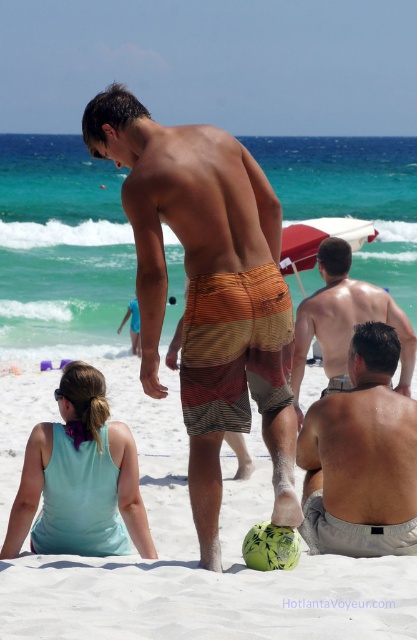
Is green textured ball at center below striped cotton shorts at center?

Indeed, green textured ball at center is positioned under striped cotton shorts at center.

Does green textured ball at center have a larger size compared to striped cotton shorts at center?

Yes, green textured ball at center is bigger than striped cotton shorts at center.

Is point (185, 592) in front of point (193, 362)?

Yes, it is in front of point (193, 362).

Locate an element on the screen. green textured ball at center is located at coordinates (198, 560).

Who is taller, green textured ball at center or light blue fabric dress at lower left?

light blue fabric dress at lower left is taller.

Who is more distant from viewer, (181, 627) or (42, 426)?

Positioned behind is point (42, 426).

In the scene shown: Who is more distant from viewer, (0, 625) or (92, 499)?

Point (92, 499)

Where is `green textured ball at center`? green textured ball at center is located at coordinates (198, 560).

Can you confirm if striped cotton shorts at center is positioned to the left of smooth tan skin at lower right?

Correct, you'll find striped cotton shorts at center to the left of smooth tan skin at lower right.

Locate an element on the screen. This screenshot has width=417, height=640. striped cotton shorts at center is located at coordinates (208, 291).